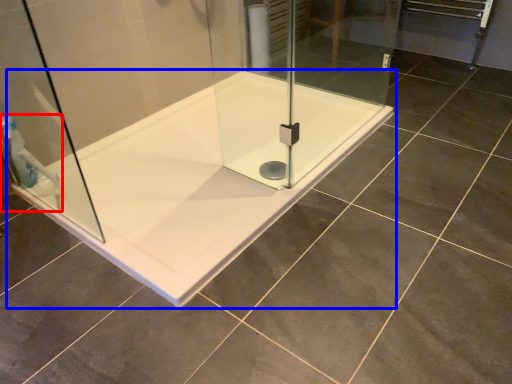
Question: Among these objects, which one is farthest to the camera, shower (highlighted by a red box) or bathtub (highlighted by a blue box)?

Choices:
 (A) shower
 (B) bathtub

Answer: (A)